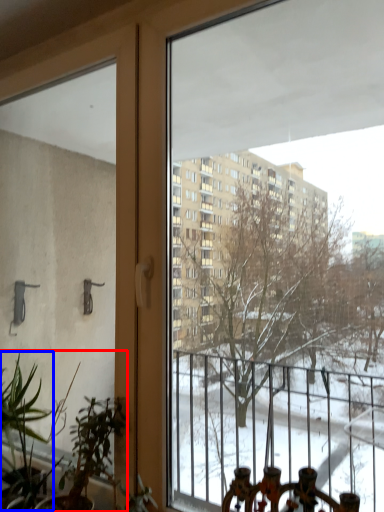
Question: Which object appears closest to the camera in this image, houseplant (highlighted by a red box) or plant (highlighted by a blue box)?

Choices:
 (A) houseplant
 (B) plant

Answer: (A)